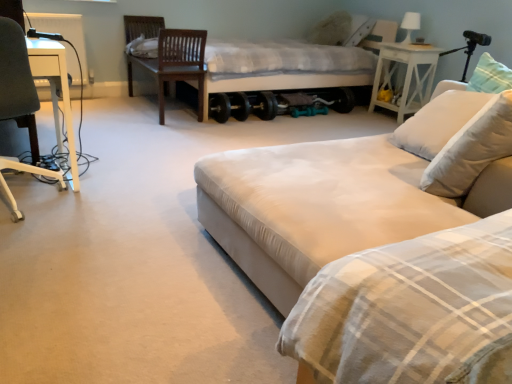
Question: Looking at their shapes, would you say white soft pillow at right is wider or thinner than dark brown wood swivel chair at upper left?

Choices:
 (A) wide
 (B) thin

Answer: (B)

Question: From the image's perspective, is white soft pillow at right positioned above or below dark brown wood swivel chair at upper left?

Choices:
 (A) above
 (B) below

Answer: (B)

Question: Which of these objects is positioned closest to the white soft pillow at right?

Choices:
 (A) dark brown wood swivel chair at upper left
 (B) white fabric bed at center, marked as the 2th bed in a top-to-bottom arrangement
 (C) white wood side table at right
 (D) white plastic chair at left
 (E) white glossy table lamp at upper right

Answer: (B)

Question: Which object is the farthest from the white fabric bed at center, which is the 2th bed in back-to-front order?

Choices:
 (A) white plastic chair at left
 (B) white wood side table at right
 (C) white glossy table lamp at upper right
 (D) white plastic radiator at upper left
 (E) white soft pillow at right

Answer: (D)